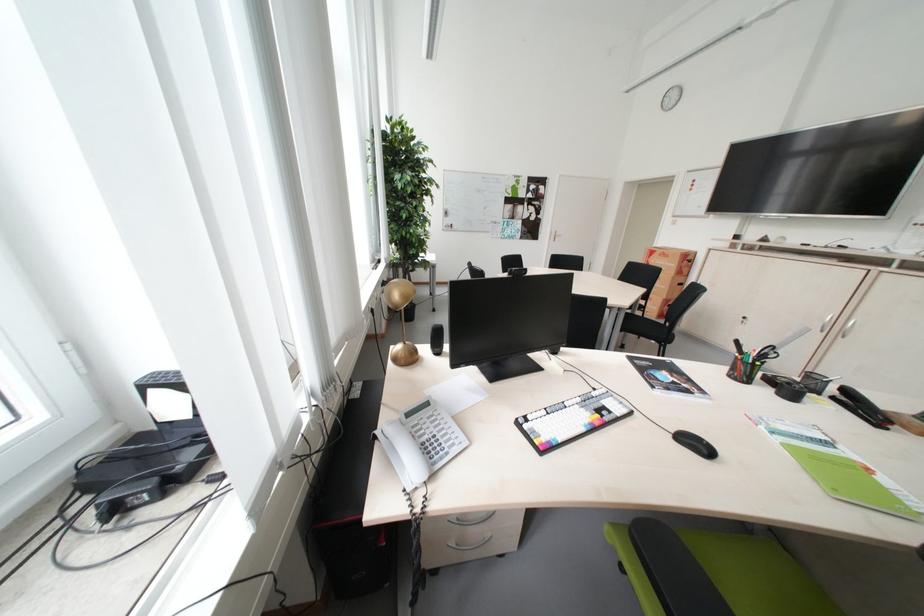
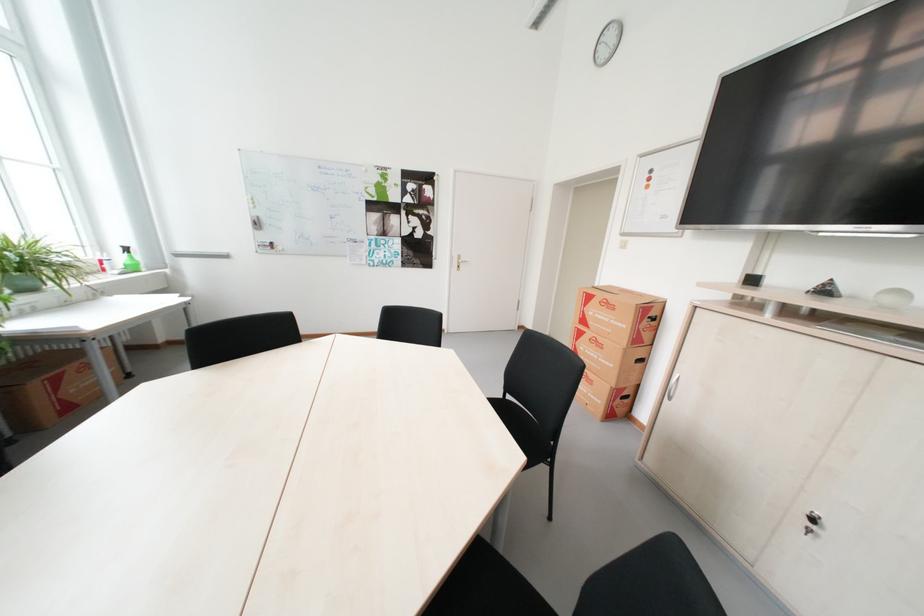
In the second image, find the point that corresponds to the point at 665,256 in the first image.

(604, 302)